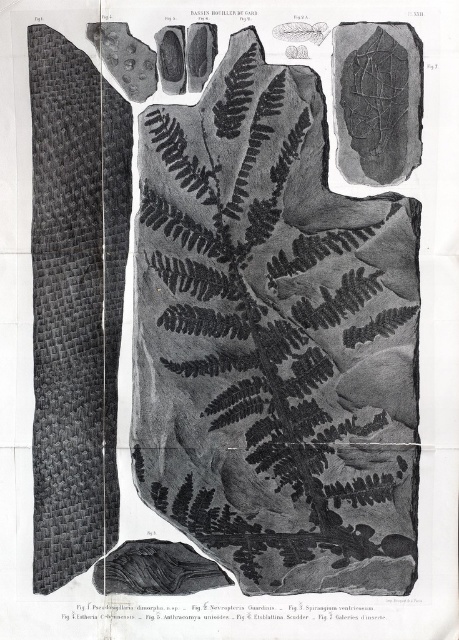
Between point (239, 164) and point (365, 93), which one is positioned in front?

Point (365, 93) is in front.

Which of these two, black textured fern at center or smooth gray rock at upper right, stands taller?

With more height is black textured fern at center.

The image size is (459, 640). I want to click on black textured fern at center, so click(x=272, y=328).